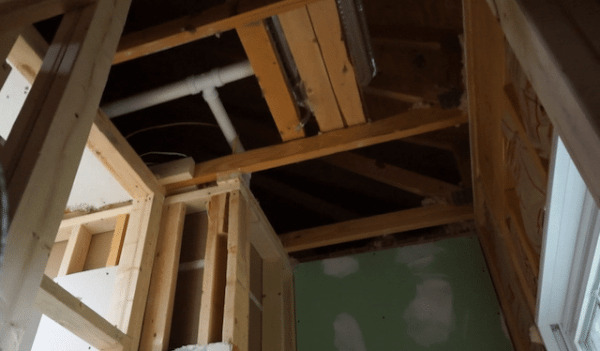
The image size is (600, 351). Identify the location of window. (592, 301).